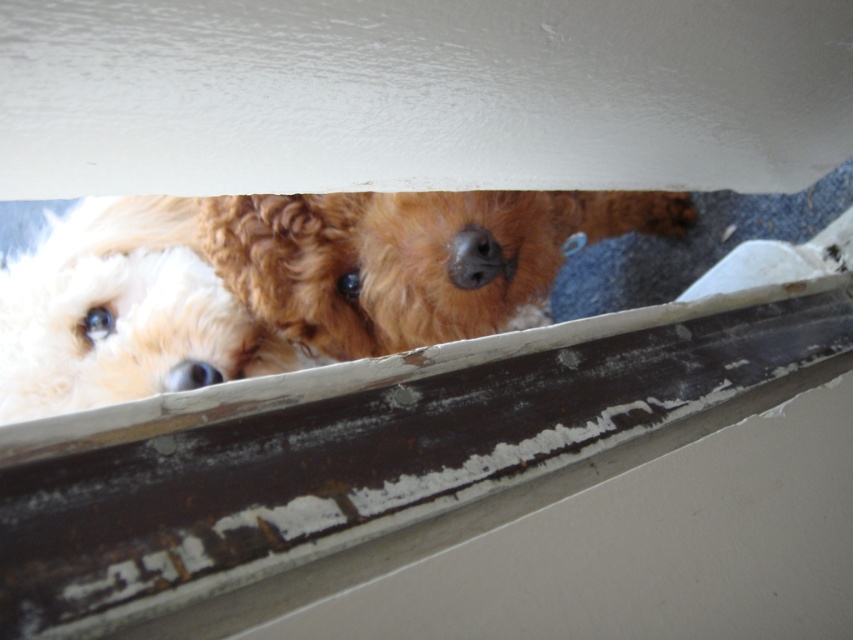
Is rusty metal window sill at lower center above white fluffy dog at left?

No.

Can you confirm if rusty metal window sill at lower center is shorter than white fluffy dog at left?

Indeed, rusty metal window sill at lower center has a lesser height compared to white fluffy dog at left.

The height and width of the screenshot is (640, 853). I want to click on rusty metal window sill at lower center, so click(369, 458).

The width and height of the screenshot is (853, 640). What are the coordinates of `rusty metal window sill at lower center` in the screenshot? It's located at (369, 458).

Does rusty metal window sill at lower center have a larger size compared to curly golden fur at center?

No, rusty metal window sill at lower center is not bigger than curly golden fur at center.

Between rusty metal window sill at lower center and curly golden fur at center, which one appears on the right side from the viewer's perspective?

rusty metal window sill at lower center is more to the right.

You are a GUI agent. You are given a task and a screenshot of the screen. Output one action in this format:
    pyautogui.click(x=<x>, y=<y>)
    Task: Click on the rusty metal window sill at lower center
    Image resolution: width=853 pixels, height=640 pixels.
    Given the screenshot: What is the action you would take?
    pyautogui.click(x=369, y=458)

Who is more forward, (523, 228) or (25, 381)?

Point (523, 228) is in front.

Can you confirm if curly golden fur at center is taller than white fluffy dog at left?

In fact, curly golden fur at center may be shorter than white fluffy dog at left.

Does point (495, 205) lie behind point (212, 300)?

No, (495, 205) is in front of (212, 300).

What are the coordinates of `curly golden fur at center` in the screenshot? It's located at (405, 257).